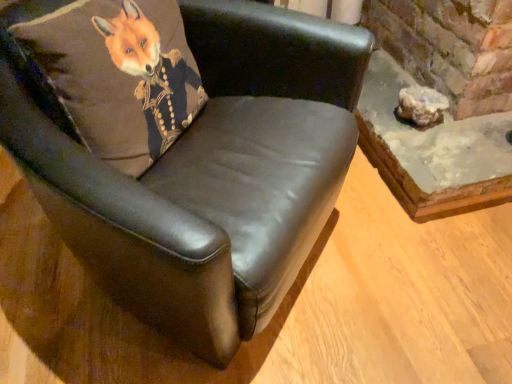
Identify the location of free space to the right of black leather chair at upper left. The height and width of the screenshot is (384, 512). (403, 280).